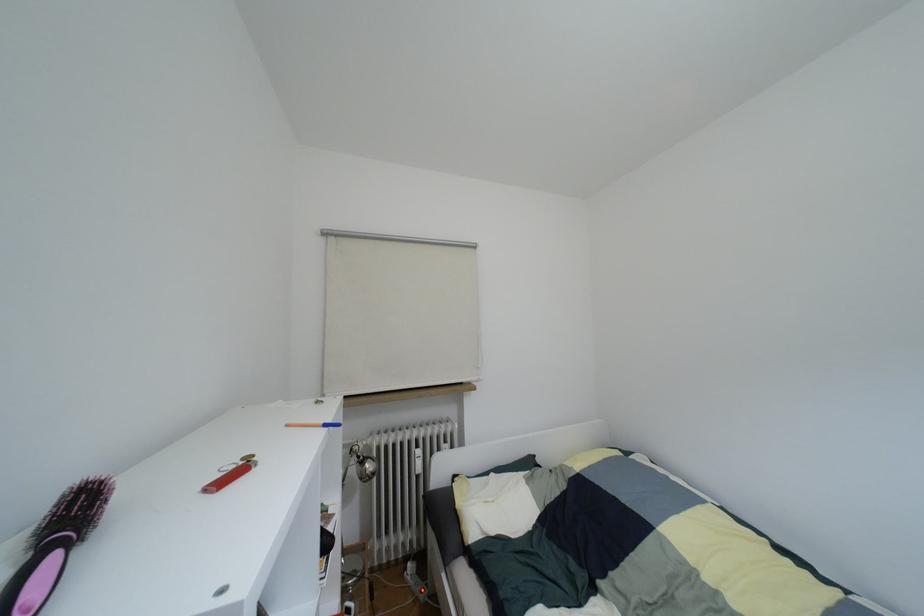
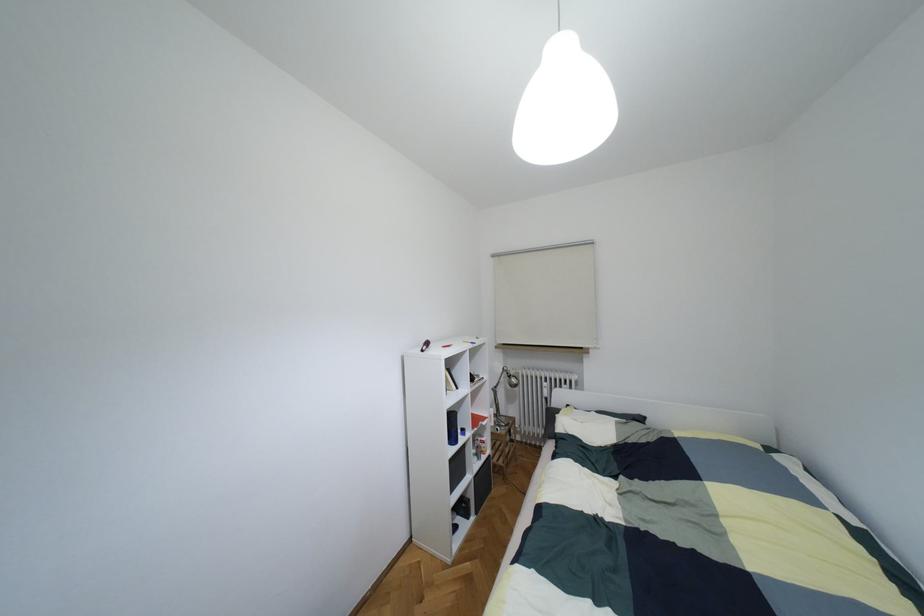
The point at (360, 461) is marked in the first image. Where is the corresponding point in the second image?

(508, 376)